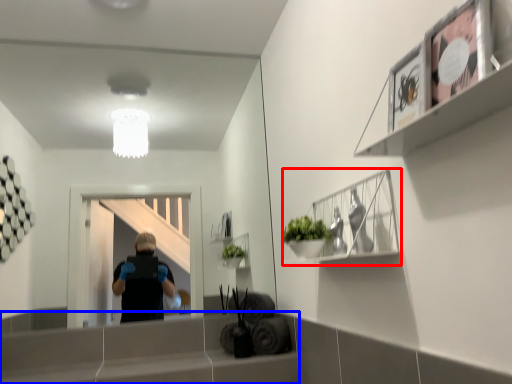
Question: Which object is further to the camera taking this photo, cabinet (highlighted by a red box) or ledge (highlighted by a blue box)?

Choices:
 (A) cabinet
 (B) ledge

Answer: (B)